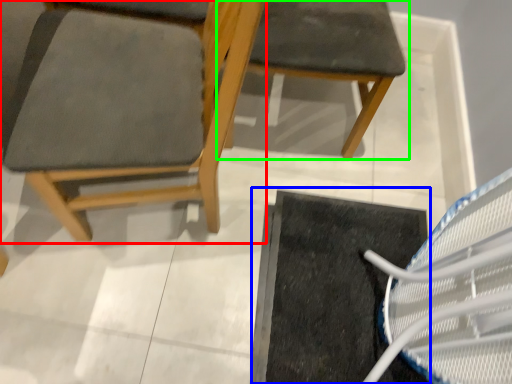
Question: Based on their relative distances, which object is nearer to chair (highlighted by a red box)? Choose from doormat (highlighted by a blue box) and chair (highlighted by a green box).

Choices:
 (A) doormat
 (B) chair

Answer: (B)